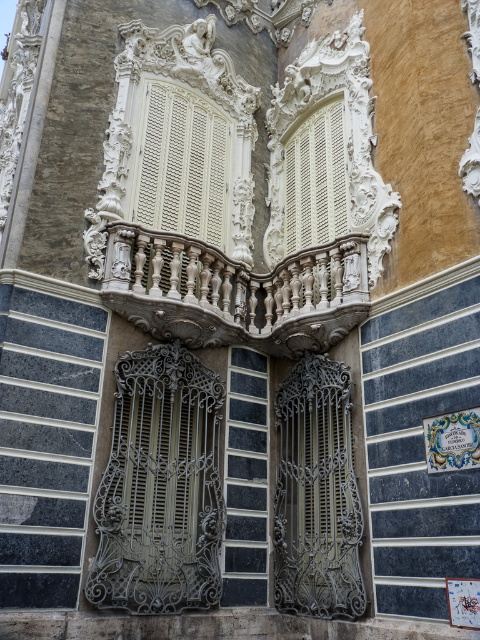
Question: Can you confirm if white carved wood balcony at center is wider than white textured shutters at center?

Choices:
 (A) yes
 (B) no

Answer: (A)

Question: Does white carved wood balcony at center have a lesser width compared to white textured shutters at center?

Choices:
 (A) no
 (B) yes

Answer: (A)

Question: Is white carved wood balustrade at center positioned behind white textured shutters at center?

Choices:
 (A) no
 (B) yes

Answer: (A)

Question: Which is farther from the white carved wood balcony at center?

Choices:
 (A) white carved wood balustrade at center
 (B) white textured shutters at center
 (C) black glass window at center

Answer: (C)

Question: Which of the following is the farthest from the observer?

Choices:
 (A) white carved wood balustrade at center
 (B) white carved wood balcony at center

Answer: (B)

Question: Based on their relative distances, which object is farther from the black glass window at center?

Choices:
 (A) white carved wood balustrade at center
 (B) white textured shutters at center
 (C) white carved wood balcony at center

Answer: (B)